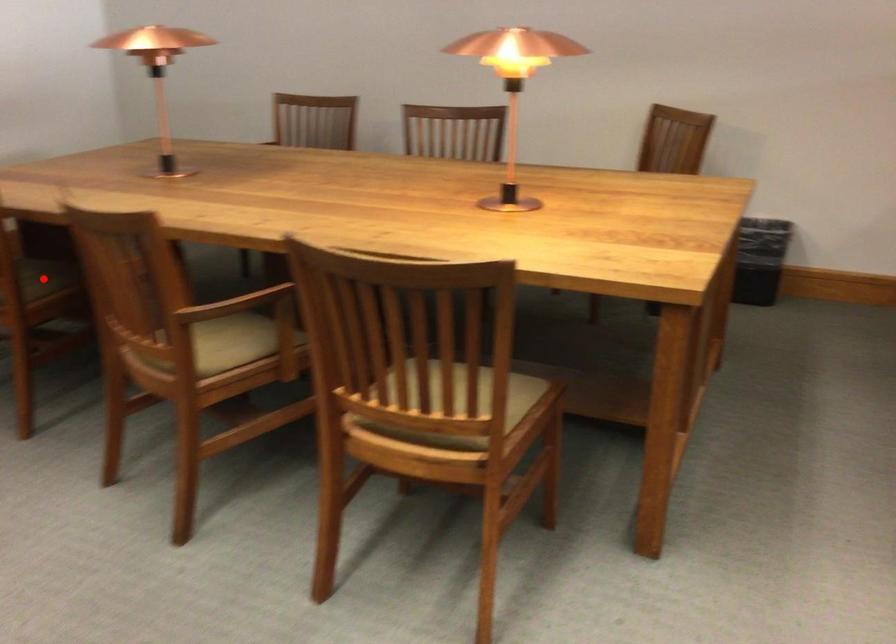
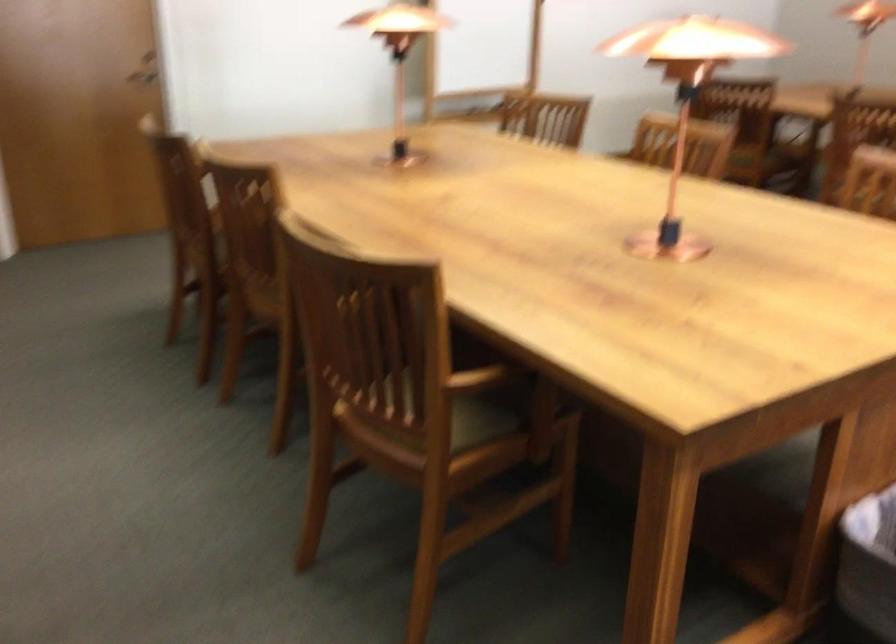
Question: I am providing you with two images of the same scene from different viewpoints. A red point is marked on the first image. Can you still see the location of the red point in image 2?

Choices:
 (A) Yes
 (B) No

Answer: (B)